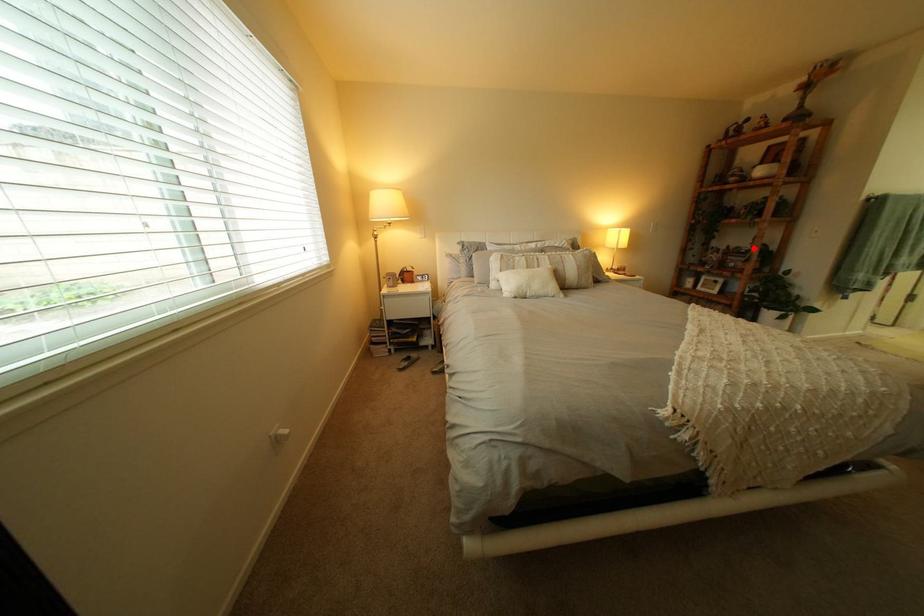
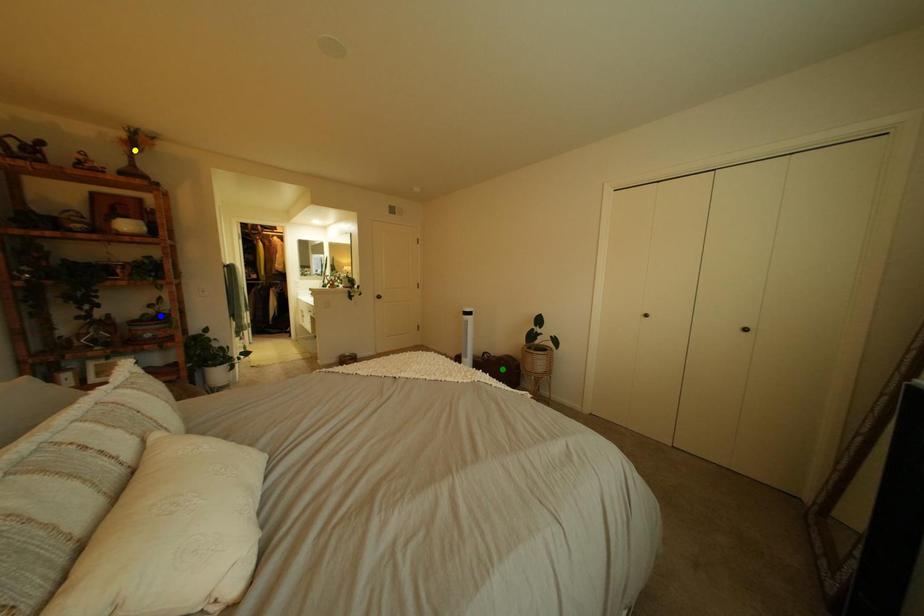
Question: I am providing you with two images of the same scene from different viewpoints. A red point is marked on the first image. You are given multiple points on the second image. Can you choose the point in image 2 that corresponds to the point in image 1?

Choices:
 (A) blue point
 (B) green point
 (C) yellow point

Answer: (A)